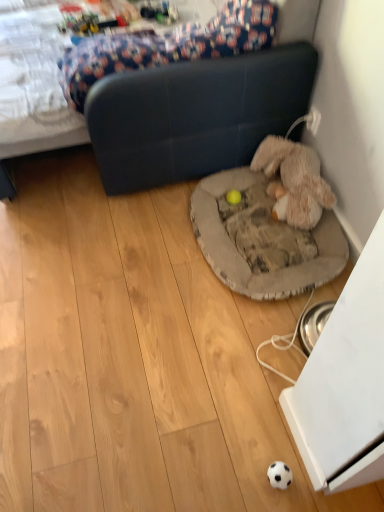
Identify the location of free space in front of gray fabric dog bed at center. The width and height of the screenshot is (384, 512). (219, 343).